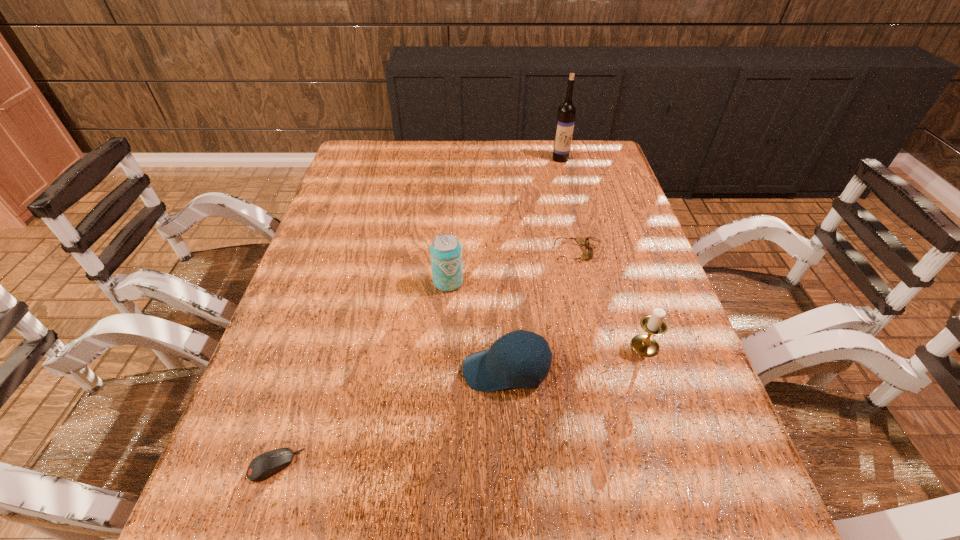
This screenshot has height=540, width=960. In order to click on the nearest object in this screenshot , I will do `click(266, 464)`.

Where is `free space located 0.260m on the label of the tallest object`? The height and width of the screenshot is (540, 960). free space located 0.260m on the label of the tallest object is located at coordinates (573, 210).

Identify the location of vacant space located 0.190m on the left of the second object from left to right. The width and height of the screenshot is (960, 540). (356, 282).

You are a GUI agent. You are given a task and a screenshot of the screen. Output one action in this format:
    pyautogui.click(x=<x>, y=<y>)
    Task: Click on the free space located 0.290m on the left of the rightmost object
    The image size is (960, 540).
    Given the screenshot: What is the action you would take?
    pyautogui.click(x=496, y=346)

This screenshot has width=960, height=540. Find the location of `vacant region located 0.250m on the front-facing side of the third object from left to right`. vacant region located 0.250m on the front-facing side of the third object from left to right is located at coordinates (341, 371).

You are a GUI agent. You are given a task and a screenshot of the screen. Output one action in this format:
    pyautogui.click(x=<x>, y=<y>)
    Task: Click on the vacant space located on the front-facing side of the third object from left to right
    The width and height of the screenshot is (960, 540).
    Given the screenshot: What is the action you would take?
    pyautogui.click(x=326, y=371)

This screenshot has width=960, height=540. I want to click on free space located 0.140m on the front-facing side of the third object from left to right, so click(x=395, y=371).

Where is `vacant space positioned on the front-facing side of the fifth tallest object`? This screenshot has height=540, width=960. vacant space positioned on the front-facing side of the fifth tallest object is located at coordinates (444, 253).

At what (x,y) coordinates should I click in order to perform the action: click on free space located on the front-facing side of the fifth tallest object. Please return your answer as a coordinate pair (x, y). The height and width of the screenshot is (540, 960). Looking at the image, I should click on (494, 253).

Find the location of a particular element. This screenshot has height=540, width=960. free space located on the front-facing side of the fifth tallest object is located at coordinates (407, 253).